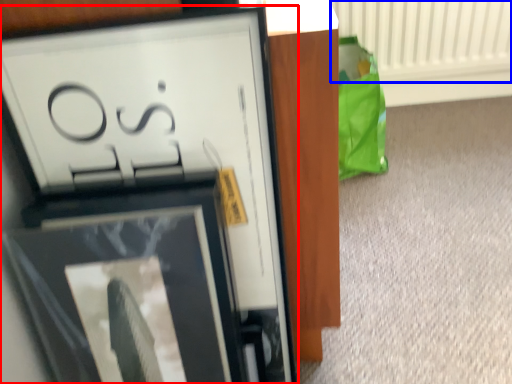
Question: Which object appears farthest to the camera in this image, picture frame (highlighted by a red box) or radiator (highlighted by a blue box)?

Choices:
 (A) picture frame
 (B) radiator

Answer: (B)